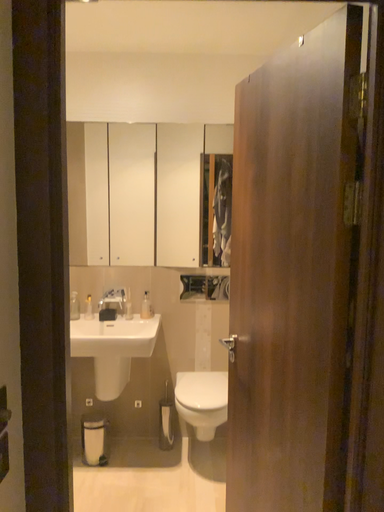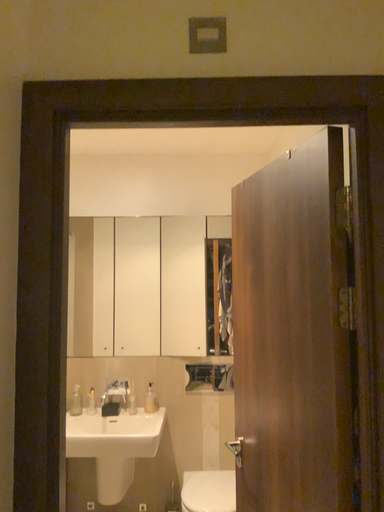
Question: Which way did the camera rotate in the video?

Choices:
 (A) rotated upward
 (B) rotated downward

Answer: (A)